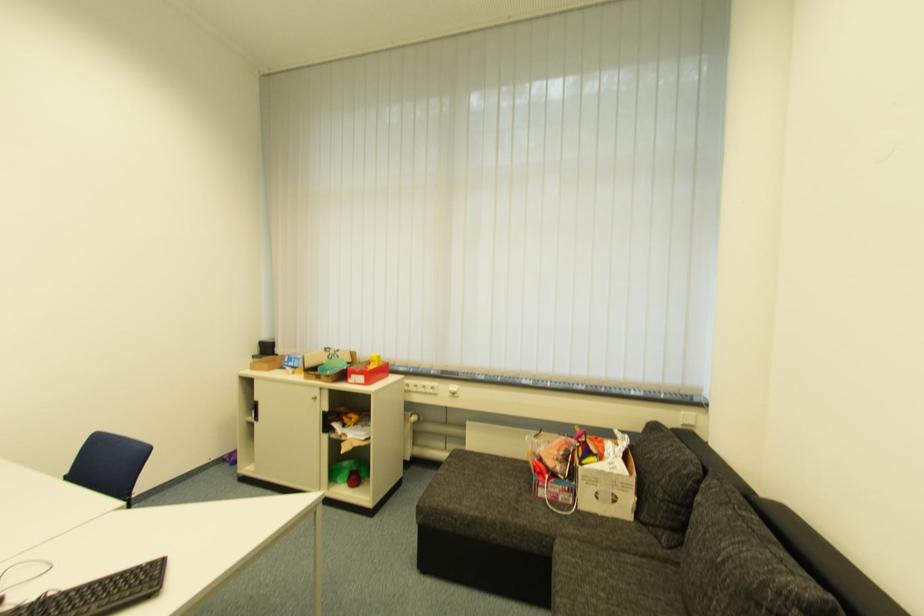
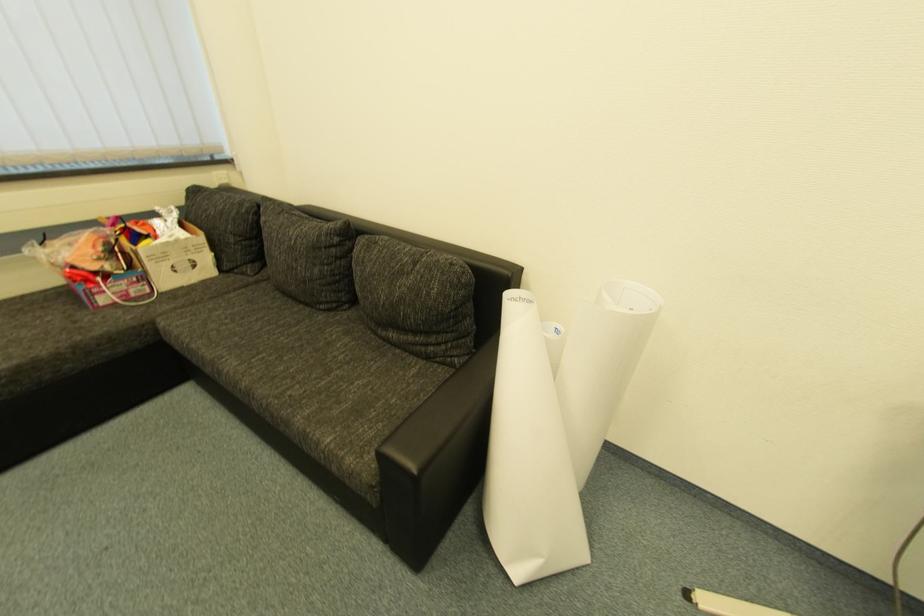
The first image is from the beginning of the video and the second image is from the end. How did the camera likely rotate when shooting the video?

The camera rotated toward right-down.